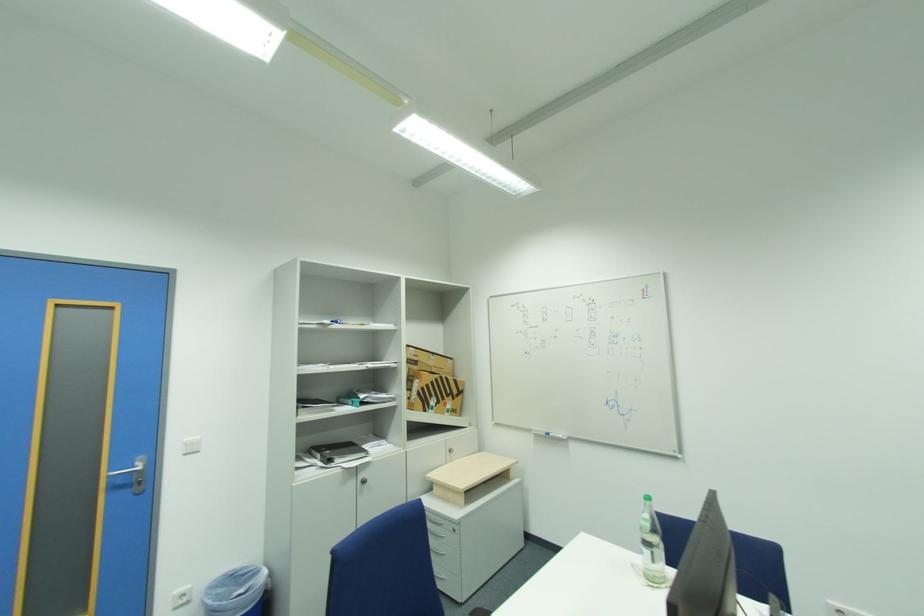
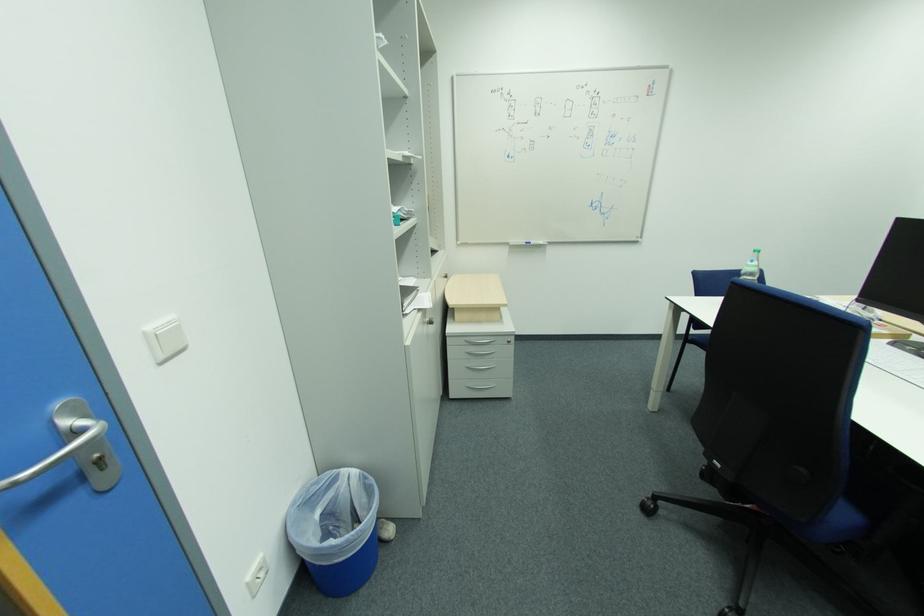
Find the pixel in the second image that matches (237,577) in the first image.

(304, 507)